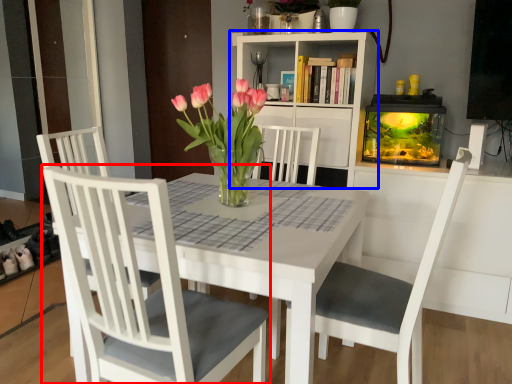
Question: Which object appears farthest to the camera in this image, chair (highlighted by a red box) or bookcase (highlighted by a blue box)?

Choices:
 (A) chair
 (B) bookcase

Answer: (B)